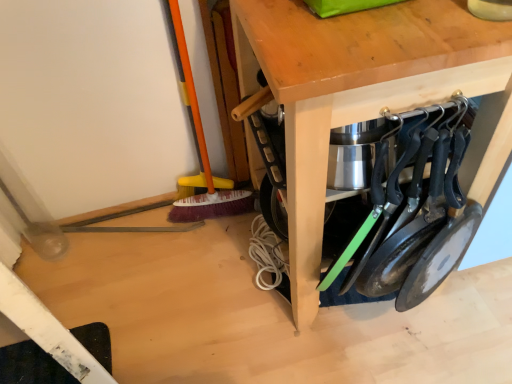
Question: Considering the relative positions of wooden table at center and black matte frying pans at lower right in the image provided, is wooden table at center to the left of black matte frying pans at lower right from the viewer's perspective?

Choices:
 (A) yes
 (B) no

Answer: (A)

Question: Does wooden table at center appear on the right side of black matte frying pans at lower right?

Choices:
 (A) yes
 (B) no

Answer: (B)

Question: Are wooden table at center and black matte frying pans at lower right beside each other?

Choices:
 (A) yes
 (B) no

Answer: (B)

Question: Is wooden table at center positioned behind black matte frying pans at lower right?

Choices:
 (A) yes
 (B) no

Answer: (B)

Question: Is black matte frying pans at lower right completely or partially inside wooden table at center?

Choices:
 (A) yes
 (B) no

Answer: (B)

Question: Is wooden table at center not near black matte frying pans at lower right?

Choices:
 (A) no
 (B) yes

Answer: (A)

Question: Can you confirm if black matte frying pans at lower right is shorter than wooden table at center?

Choices:
 (A) yes
 (B) no

Answer: (A)

Question: Can you confirm if black matte frying pans at lower right is thinner than wooden table at center?

Choices:
 (A) yes
 (B) no

Answer: (A)

Question: Does black matte frying pans at lower right have a greater height compared to wooden table at center?

Choices:
 (A) yes
 (B) no

Answer: (B)

Question: Is black matte frying pans at lower right surrounding wooden table at center?

Choices:
 (A) no
 (B) yes

Answer: (A)

Question: From the image's perspective, would you say black matte frying pans at lower right is shown under wooden table at center?

Choices:
 (A) no
 (B) yes

Answer: (B)

Question: Would you say black matte frying pans at lower right is outside wooden table at center?

Choices:
 (A) yes
 (B) no

Answer: (A)

Question: From the image's perspective, relative to black matte frying pans at lower right, is wooden table at center above or below?

Choices:
 (A) above
 (B) below

Answer: (A)